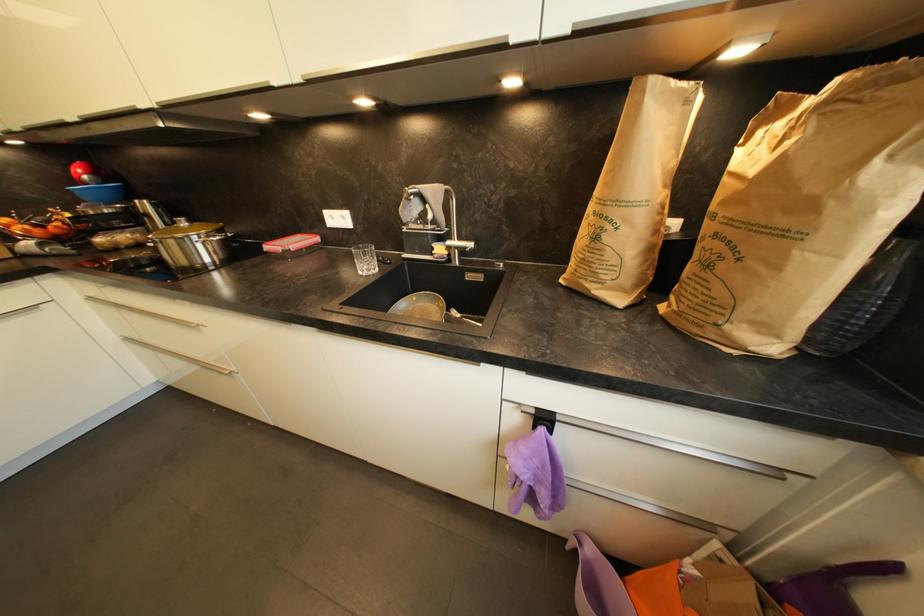
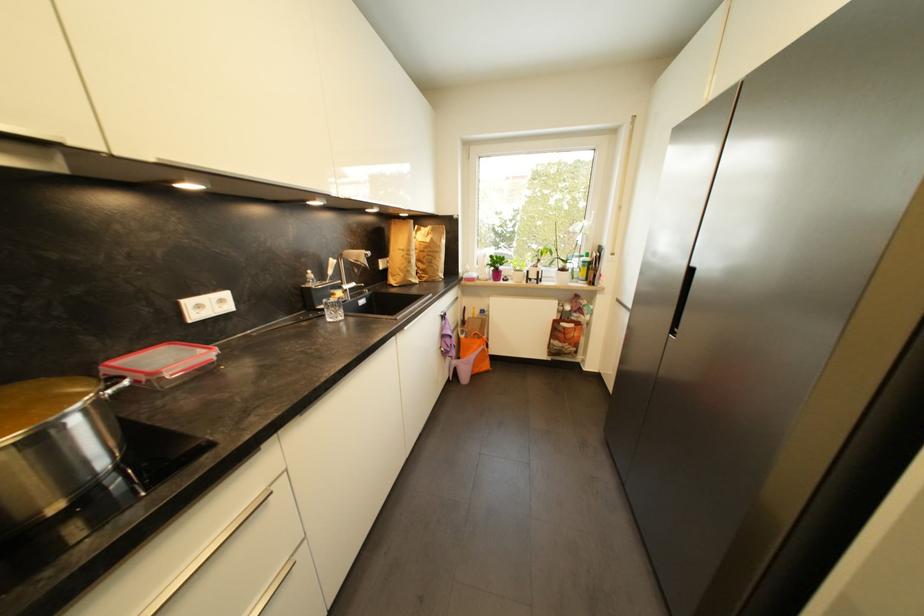
In the second image, find the point that corresponds to (x=730, y=204) in the first image.

(430, 249)